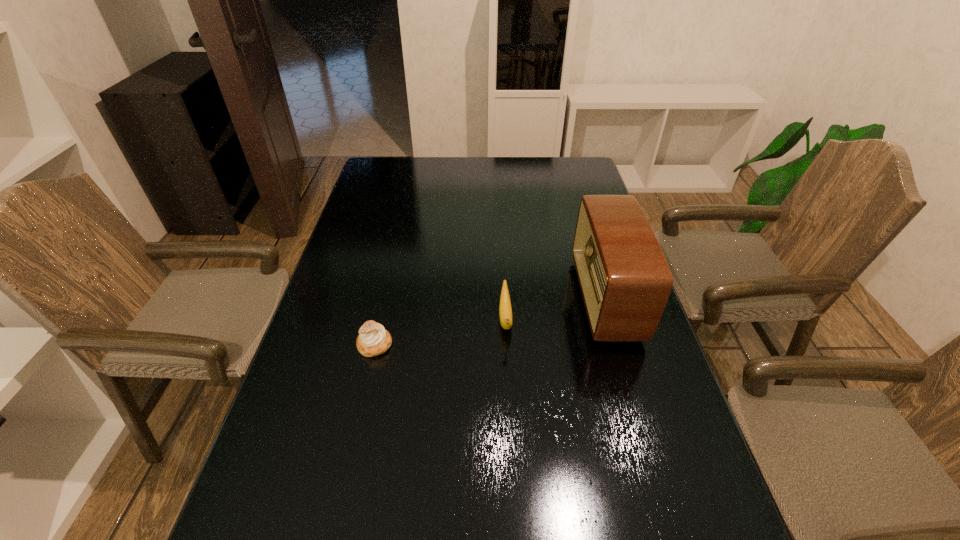
Locate an element on the screen. free space between the radio receiver and the banana is located at coordinates (556, 309).

Locate an element on the screen. The height and width of the screenshot is (540, 960). free point between the radio receiver and the shortest object is located at coordinates (490, 322).

Locate an element on the screen. This screenshot has width=960, height=540. the closest object to the shortest object is located at coordinates (505, 310).

Locate an element on the screen. the second closest object to the second object from right to left is located at coordinates (373, 339).

The image size is (960, 540). Identify the location of vacant area in the image that satisfies the following two spatial constraints: 1. on the front-facing side of the radio receiver; 2. at the stem of the banana. (611, 319).

Locate an element on the screen. This screenshot has width=960, height=540. free location that satisfies the following two spatial constraints: 1. on the front-facing side of the radio receiver; 2. at the stem of the banana is located at coordinates (611, 319).

Locate an element on the screen. vacant space that satisfies the following two spatial constraints: 1. on the front-facing side of the radio receiver; 2. at the stem of the second object from right to left is located at coordinates (611, 319).